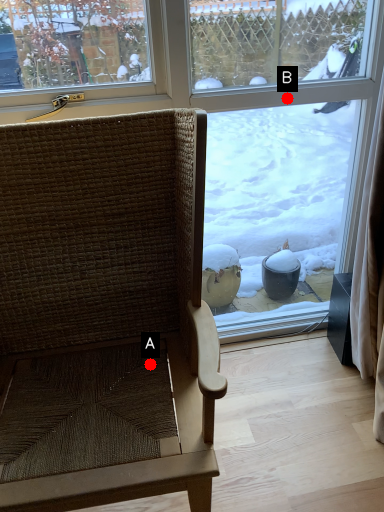
Question: Two points are circled on the image, labeled by A and B beside each circle. Which point appears closest to the camera in this image?

Choices:
 (A) A is closer
 (B) B is closer

Answer: (A)